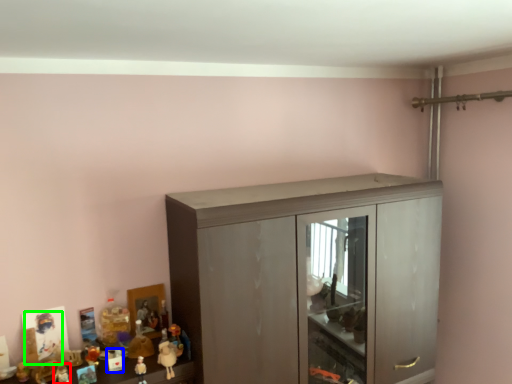
Question: Based on their relative distances, which object is farther from toy (highlighted by a red box)? Choose from toy (highlighted by a blue box) and toy (highlighted by a green box).

Choices:
 (A) toy
 (B) toy

Answer: (A)